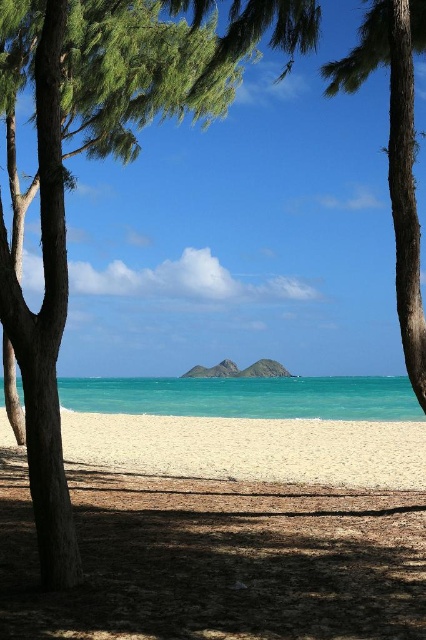
Does white sand at center have a lesser height compared to brown textured tree at center?

Correct, white sand at center is not as tall as brown textured tree at center.

Which is behind, point (331, 465) or point (365, 26)?

Positioned behind is point (331, 465).

Between point (143, 577) and point (402, 80), which one is positioned behind?

Point (402, 80)

Find the location of a particular element. The image size is (426, 640). white sand at center is located at coordinates (226, 531).

Who is positioned more to the left, white sand at center or white sandy beach at center?

From the viewer's perspective, white sand at center appears more on the left side.

Who is more forward, (221, 467) or (244, 424)?

Point (221, 467) is in front.

The width and height of the screenshot is (426, 640). What do you see at coordinates (226, 531) in the screenshot?
I see `white sand at center` at bounding box center [226, 531].

In order to click on white sand at center in this screenshot , I will do `click(226, 531)`.

Is green leafy tree at center bigger than turquoise water at center?

Actually, green leafy tree at center might be smaller than turquoise water at center.

From the picture: Between green leafy tree at center and turquoise water at center, which one appears on the right side from the viewer's perspective?

turquoise water at center is more to the right.

Image resolution: width=426 pixels, height=640 pixels. I want to click on green leafy tree at center, so click(x=45, y=323).

The image size is (426, 640). I want to click on green leafy tree at center, so click(45, 323).